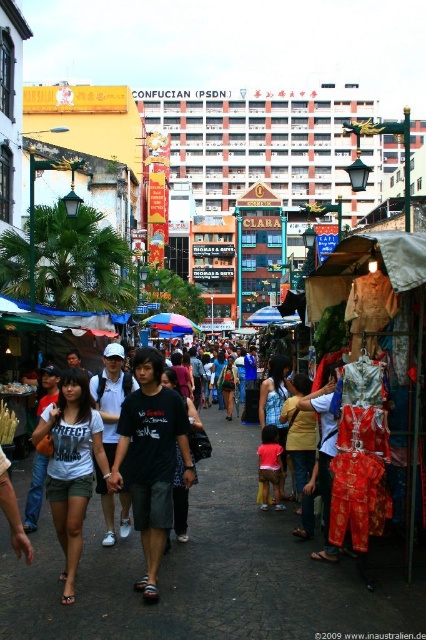
Does black cotton shirt at center have a lesser height compared to dark clothing crowd at center?

In fact, black cotton shirt at center may be taller than dark clothing crowd at center.

You are a GUI agent. You are given a task and a screenshot of the screen. Output one action in this format:
    pyautogui.click(x=<x>, y=<y>)
    Task: Click on the black cotton shirt at center
    
    Given the screenshot: What is the action you would take?
    pyautogui.click(x=152, y=460)

Image resolution: width=426 pixels, height=640 pixels. Describe the element at coordinates (71, 465) in the screenshot. I see `white cotton t-shirt at center` at that location.

Which of these two, white cotton t-shirt at center or dark clothing crowd at center, stands taller?

white cotton t-shirt at center

Who is more distant from viewer, (77, 476) or (256, 412)?

The point (256, 412) is more distant.

Locate an element on the screen. This screenshot has width=426, height=640. white cotton t-shirt at center is located at coordinates (71, 465).

Is black cotton shirt at center smaller than white cotton t-shirt at center?

Yes.

Does black cotton shirt at center appear over white cotton t-shirt at center?

Yes.

This screenshot has height=640, width=426. What do you see at coordinates (152, 460) in the screenshot?
I see `black cotton shirt at center` at bounding box center [152, 460].

Identify the location of black cotton shirt at center. This screenshot has width=426, height=640. (152, 460).